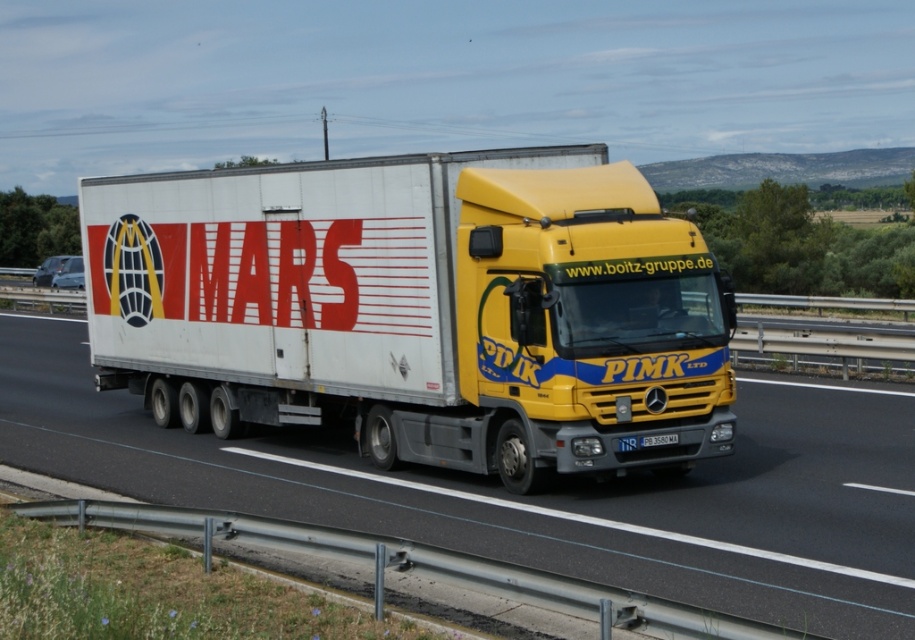
Is white matte trailer at center to the right of white matte truck at center from the viewer's perspective?

Indeed, white matte trailer at center is positioned on the right side of white matte truck at center.

The image size is (915, 640). Identify the location of white matte trailer at center. (417, 308).

Is point (418, 348) positioned in front of point (776, 496)?

No, (418, 348) is further to viewer.

Identify the location of white matte trailer at center. This screenshot has width=915, height=640. (417, 308).

Consider the image. Between white matte truck at center and white plastic license plate at center, which one is positioned lower?

white matte truck at center is below.

Can you confirm if white matte truck at center is thinner than white plastic license plate at center?

No.

The height and width of the screenshot is (640, 915). What do you see at coordinates (537, 493) in the screenshot? I see `white matte truck at center` at bounding box center [537, 493].

Locate an element on the screen. The width and height of the screenshot is (915, 640). white matte truck at center is located at coordinates (537, 493).

Where is `white matte trailer at center`? The width and height of the screenshot is (915, 640). white matte trailer at center is located at coordinates (417, 308).

Is white matte trailer at center wider than white plastic license plate at center?

Yes, white matte trailer at center is wider than white plastic license plate at center.

The height and width of the screenshot is (640, 915). What are the coordinates of `white matte trailer at center` in the screenshot? It's located at (417, 308).